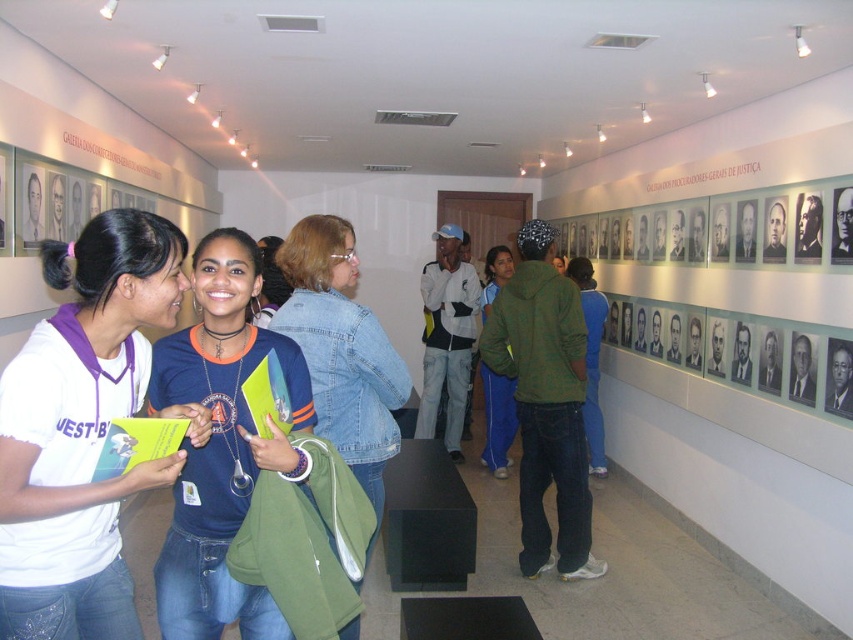
Question: Does white matte t-shirt at center have a lesser width compared to blue denim jeans at center?

Choices:
 (A) no
 (B) yes

Answer: (A)

Question: Is blue denim jacket at center in front of denim jacket at center?

Choices:
 (A) yes
 (B) no

Answer: (A)

Question: Which point is closer to the camera taking this photo?

Choices:
 (A) (73, 273)
 (B) (482, 364)
 (C) (315, 324)
 (D) (235, 531)

Answer: (A)

Question: From the image, what is the correct spatial relationship of blue denim jacket at center in relation to denim jacket at center?

Choices:
 (A) below
 (B) above

Answer: (A)

Question: Which point appears farthest from the camera in this image?

Choices:
 (A) (509, 401)
 (B) (300, 262)
 (C) (218, 512)

Answer: (A)

Question: Estimate the real-world distances between objects in this image. Which object is closer to the blue denim jacket at center?

Choices:
 (A) denim jacket at center
 (B) white matte t-shirt at center
 (C) blue denim jeans at center

Answer: (B)